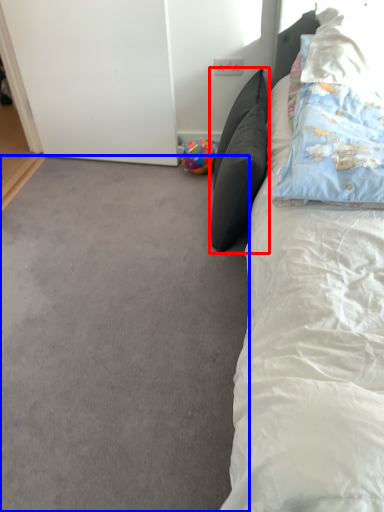
Question: Which object is further to the camera taking this photo, pillow (highlighted by a red box) or plain (highlighted by a blue box)?

Choices:
 (A) pillow
 (B) plain

Answer: (A)